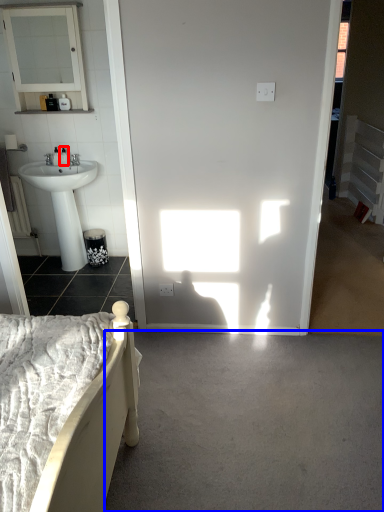
Question: Which object appears closest to the camera in this image, toiletry (highlighted by a red box) or concrete (highlighted by a blue box)?

Choices:
 (A) toiletry
 (B) concrete

Answer: (B)